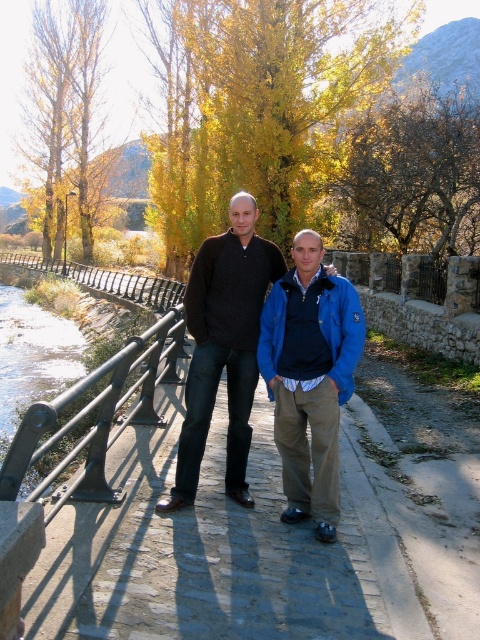
You are standing on the cobblestone path and want to take a photo of the matte black sweater at center. Your camera is 3.95 meters away from the sweater. Can you capture the entire sweater in your photo without moving the camera?

The camera is 3.95 meters away from the matte black sweater at center. Since the distance is exactly 3.95 meters, you can capture the entire sweater in your photo without moving the camera.

You are a photographer trying to capture a photo of the blue fabric jacket at center and the matte black sweater at center. Based on their positions, which one is positioned lower in the frame?

The blue fabric jacket at center is below the matte black sweater at center, so the blue fabric jacket at center is positioned lower in the frame.